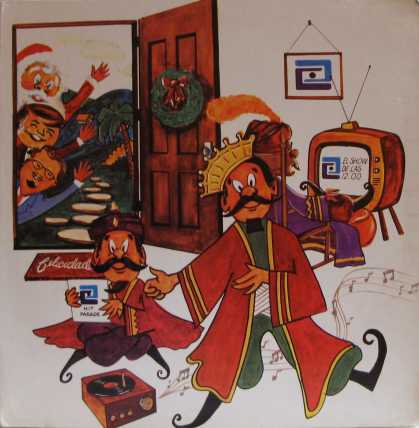
At what (x,y) coordinates should I click in order to perform the action: click on vinyl music box. Please return your answer as a coordinate pair (x, y). This screenshot has height=428, width=419. Looking at the image, I should click on (133, 401), (110, 389).